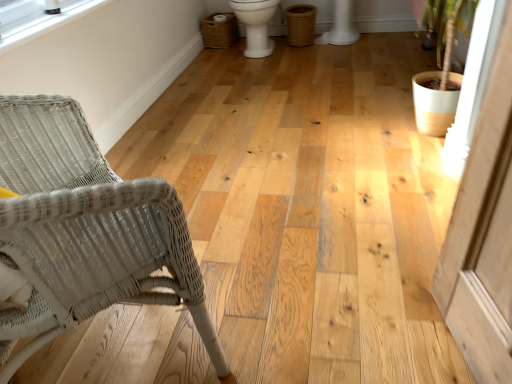
Locate an element on the screen. Image resolution: width=512 pixels, height=384 pixels. vacant area in front of white glossy toilet bowl at center is located at coordinates (258, 74).